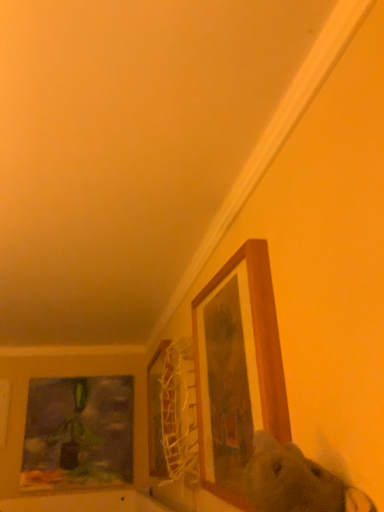
The width and height of the screenshot is (384, 512). Describe the element at coordinates (156, 413) in the screenshot. I see `wooden picture frame at center, which ranks as the third picture frame in left-to-right order` at that location.

In order to face wooden picture frame at center, positioned as the second picture frame in right-to-left order, should I rotate leftwards or rightwards?

Rotate left and turn 5.150 degrees.

The height and width of the screenshot is (512, 384). I want to click on wooden frame at upper right, which is counted as the first picture frame, starting from the front, so click(238, 367).

Identify the location of wooden picture frame at lower left, the second picture frame when ordered from back to front. The image size is (384, 512). (4, 409).

I want to click on wooden picture frame at center, the 3th picture frame from the back, so click(x=156, y=413).

From the image's perspective, which is below, wooden picture frame at center, positioned as the second picture frame in right-to-left order, or fluffy white dog at center?

wooden picture frame at center, positioned as the second picture frame in right-to-left order, appears lower in the image.

Which is in front, point (152, 378) or point (329, 474)?

The point (329, 474) is more forward.

Is wooden picture frame at center, positioned as the second picture frame in right-to-left order, to the right of fluffy white dog at center from the viewer's perspective?

No.

Can you tell me how much matte glass painting at left, the 2th picture frame when ordered from left to right, and wooden frame at upper right, which is counted as the first picture frame, starting from the front, differ in facing direction?

matte glass painting at left, the 2th picture frame when ordered from left to right, and wooden frame at upper right, which is counted as the first picture frame, starting from the front, are facing 90 degrees away from each other.

How far apart are matte glass painting at left, the first picture frame when ordered from back to front, and wooden frame at upper right, which is counted as the first picture frame, starting from the front?

1.02 meters.

From a real-world perspective, who is located lower, matte glass painting at left, which is counted as the 3th picture frame, starting from the right, or wooden frame at upper right, the 4th picture frame viewed from the back?

In real-world perspective, matte glass painting at left, which is counted as the 3th picture frame, starting from the right, is lower.

Looking at this image, can you see matte glass painting at left, the first picture frame when ordered from back to front, touching wooden frame at upper right, the first picture frame from the right?

matte glass painting at left, the first picture frame when ordered from back to front, is not next to wooden frame at upper right, the first picture frame from the right, and they're not touching.

Does fluffy white dog at center have a greater width compared to wooden picture frame at center, which ranks as the third picture frame in left-to-right order?

Yes, fluffy white dog at center is wider than wooden picture frame at center, which ranks as the third picture frame in left-to-right order.

Considering the relative positions of fluffy white dog at center and wooden picture frame at center, which ranks as the third picture frame in left-to-right order, in the image provided, is fluffy white dog at center to the left of wooden picture frame at center, which ranks as the third picture frame in left-to-right order, from the viewer's perspective?

No, fluffy white dog at center is not to the left of wooden picture frame at center, which ranks as the third picture frame in left-to-right order.

Is fluffy white dog at center shorter than wooden picture frame at center, the 3th picture frame from the back?

Yes.

Which of these two, fluffy white dog at center or wooden picture frame at center, the 3th picture frame from the back, is bigger?

wooden picture frame at center, the 3th picture frame from the back, is bigger.

Is wooden picture frame at center, positioned as the second picture frame in right-to-left order, bigger or smaller than matte glass painting at left, the 2th picture frame when ordered from left to right?

Considering their sizes, wooden picture frame at center, positioned as the second picture frame in right-to-left order, takes up more space than matte glass painting at left, the 2th picture frame when ordered from left to right.

From a real-world perspective, is wooden picture frame at center, which ranks as the third picture frame in left-to-right order, physically above matte glass painting at left, the 2th picture frame when ordered from left to right?

Yes, from a real-world perspective, wooden picture frame at center, which ranks as the third picture frame in left-to-right order, is on top of matte glass painting at left, the 2th picture frame when ordered from left to right.

At what (x,y) coordinates should I click in order to perform the action: click on the 2nd picture frame in front of the matte glass painting at left, which is the fourth picture frame from front to back. Please return your answer as a coordinate pair (x, y). This screenshot has width=384, height=512. Looking at the image, I should click on (156, 413).

Between wooden picture frame at center, the 2th picture frame viewed from the front, and matte glass painting at left, which is the fourth picture frame from front to back, which one appears on the right side from the viewer's perspective?

wooden picture frame at center, the 2th picture frame viewed from the front, is more to the right.

Which object is wider, fluffy white dog at center or wooden frame at upper right, which is counted as the first picture frame, starting from the front?

fluffy white dog at center.

In the scene shown: Measure the distance between fluffy white dog at center and wooden frame at upper right, the first picture frame from the right.

They are 9.17 inches apart.

Based on the photo, considering the relative sizes of fluffy white dog at center and wooden frame at upper right, the 4th picture frame viewed from the back, in the image provided, is fluffy white dog at center bigger than wooden frame at upper right, the 4th picture frame viewed from the back,?

Actually, fluffy white dog at center might be smaller than wooden frame at upper right, the 4th picture frame viewed from the back.

Based on the photo, considering the relative sizes of fluffy white dog at center and wooden frame at upper right, the 4th picture frame viewed from the back, in the image provided, is fluffy white dog at center taller than wooden frame at upper right, the 4th picture frame viewed from the back,?

No, fluffy white dog at center is not taller than wooden frame at upper right, the 4th picture frame viewed from the back.

From the picture: Can you confirm if wooden picture frame at lower left, the second picture frame when ordered from back to front, is positioned to the left of wooden picture frame at center, which ranks as the third picture frame in left-to-right order?

Yes, wooden picture frame at lower left, the second picture frame when ordered from back to front, is to the left of wooden picture frame at center, which ranks as the third picture frame in left-to-right order.

In the scene shown: From the image's perspective, is wooden picture frame at lower left, the first picture frame when ordered from left to right, positioned above or below wooden picture frame at center, the 2th picture frame viewed from the front?

Based on their image positions, wooden picture frame at lower left, the first picture frame when ordered from left to right, is located beneath wooden picture frame at center, the 2th picture frame viewed from the front.

What's the angular difference between wooden picture frame at lower left, the second picture frame when ordered from back to front, and wooden picture frame at center, which ranks as the third picture frame in left-to-right order,'s facing directions?

90 degrees separate the facing orientations of wooden picture frame at lower left, the second picture frame when ordered from back to front, and wooden picture frame at center, which ranks as the third picture frame in left-to-right order.

Could you measure the distance between wooden picture frame at lower left, the second picture frame when ordered from back to front, and wooden picture frame at center, positioned as the second picture frame in right-to-left order?

wooden picture frame at lower left, the second picture frame when ordered from back to front, and wooden picture frame at center, positioned as the second picture frame in right-to-left order, are 24.21 inches apart.

Considering the positions of objects wooden picture frame at center, which ranks as the third picture frame in left-to-right order, and wooden frame at upper right, which is counted as the first picture frame, starting from the front, in the image provided, who is more to the left, wooden picture frame at center, which ranks as the third picture frame in left-to-right order, or wooden frame at upper right, which is counted as the first picture frame, starting from the front,?

Positioned to the left is wooden picture frame at center, which ranks as the third picture frame in left-to-right order.

Which object is further away from the camera, wooden picture frame at center, the 2th picture frame viewed from the front, or wooden frame at upper right, the first picture frame from the right?

wooden picture frame at center, the 2th picture frame viewed from the front, is further from the camera.

Find the location of `picture frame in front of the wooden picture frame at center, positioned as the second picture frame in right-to-left order`. picture frame in front of the wooden picture frame at center, positioned as the second picture frame in right-to-left order is located at coordinates (238, 367).

Locate an element on the screen. The width and height of the screenshot is (384, 512). animal in front of the wooden picture frame at center, the 2th picture frame viewed from the front is located at coordinates (296, 482).

Where is `the 3rd picture frame behind the wooden frame at upper right, arranged as the 4th picture frame when viewed from the left`? the 3rd picture frame behind the wooden frame at upper right, arranged as the 4th picture frame when viewed from the left is located at coordinates (78, 433).

Considering their positions, is wooden frame at upper right, arranged as the 4th picture frame when viewed from the left, positioned closer to matte glass painting at left, the first picture frame when ordered from back to front, than fluffy white dog at center?

Among the two, wooden frame at upper right, arranged as the 4th picture frame when viewed from the left, is located nearer to matte glass painting at left, the first picture frame when ordered from back to front.

Estimate the real-world distances between objects in this image. Which object is further from wooden picture frame at lower left, the first picture frame when ordered from left to right, wooden frame at upper right, arranged as the 4th picture frame when viewed from the left, or wooden picture frame at center, the 2th picture frame viewed from the front?

wooden frame at upper right, arranged as the 4th picture frame when viewed from the left, is further to wooden picture frame at lower left, the first picture frame when ordered from left to right.

When comparing their distances from fluffy white dog at center, does matte glass painting at left, which is the fourth picture frame from front to back, or wooden frame at upper right, arranged as the 4th picture frame when viewed from the left, seem further?

Among the two, matte glass painting at left, which is the fourth picture frame from front to back, is located further to fluffy white dog at center.

Based on their spatial positions, is wooden picture frame at center, the 3th picture frame from the back, or fluffy white dog at center further from matte glass painting at left, which is counted as the 3th picture frame, starting from the right?

fluffy white dog at center is further to matte glass painting at left, which is counted as the 3th picture frame, starting from the right.

Based on their spatial positions, is fluffy white dog at center or wooden frame at upper right, arranged as the 4th picture frame when viewed from the left, closer to wooden picture frame at lower left, the 3th picture frame from the front?

wooden frame at upper right, arranged as the 4th picture frame when viewed from the left, lies closer to wooden picture frame at lower left, the 3th picture frame from the front, than the other object.

When comparing their distances from wooden frame at upper right, arranged as the 4th picture frame when viewed from the left, does wooden picture frame at center, positioned as the second picture frame in right-to-left order, or matte glass painting at left, which is counted as the 3th picture frame, starting from the right, seem closer?

Based on the image, wooden picture frame at center, positioned as the second picture frame in right-to-left order, appears to be nearer to wooden frame at upper right, arranged as the 4th picture frame when viewed from the left.

When comparing their distances from wooden frame at upper right, the 4th picture frame viewed from the back, does fluffy white dog at center or wooden picture frame at lower left, the second picture frame when ordered from back to front, seem closer?

fluffy white dog at center is closer to wooden frame at upper right, the 4th picture frame viewed from the back.

From the image, which object appears to be nearer to wooden picture frame at lower left, the 3th picture frame from the front, wooden frame at upper right, arranged as the 4th picture frame when viewed from the left, or matte glass painting at left, which is counted as the 3th picture frame, starting from the right?

matte glass painting at left, which is counted as the 3th picture frame, starting from the right, is closer to wooden picture frame at lower left, the 3th picture frame from the front.

Identify the location of picture frame located between fluffy white dog at center and wooden picture frame at center, positioned as the second picture frame in right-to-left order, in the depth direction. This screenshot has width=384, height=512. (238, 367).

Locate an element on the screen. The image size is (384, 512). picture frame situated between wooden picture frame at lower left, the second picture frame when ordered from back to front, and wooden picture frame at center, the 3th picture frame from the back, from left to right is located at coordinates (78, 433).

Where is `picture frame located between wooden frame at upper right, arranged as the 4th picture frame when viewed from the left, and wooden picture frame at lower left, which appears as the fourth picture frame when viewed from the right, in the depth direction`? This screenshot has height=512, width=384. picture frame located between wooden frame at upper right, arranged as the 4th picture frame when viewed from the left, and wooden picture frame at lower left, which appears as the fourth picture frame when viewed from the right, in the depth direction is located at coordinates (156, 413).